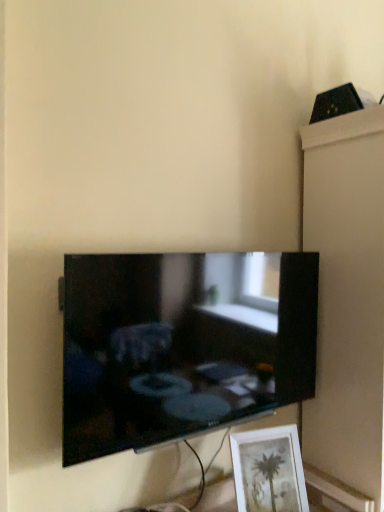
Question: Is black glossy tv at center next to matte white picture frame at lower right and touching it?

Choices:
 (A) yes
 (B) no

Answer: (B)

Question: Does black glossy tv at center have a lesser height compared to matte white picture frame at lower right?

Choices:
 (A) no
 (B) yes

Answer: (A)

Question: Is black glossy tv at center wider than matte white picture frame at lower right?

Choices:
 (A) yes
 (B) no

Answer: (B)

Question: Can you confirm if black glossy tv at center is positioned to the right of matte white picture frame at lower right?

Choices:
 (A) yes
 (B) no

Answer: (B)

Question: Does black glossy tv at center contain matte white picture frame at lower right?

Choices:
 (A) no
 (B) yes

Answer: (A)

Question: Can you confirm if black glossy tv at center is taller than matte white picture frame at lower right?

Choices:
 (A) no
 (B) yes

Answer: (B)

Question: Are black glossy tv at center and white glossy cabinet at upper right located far from each other?

Choices:
 (A) no
 (B) yes

Answer: (A)

Question: Is black glossy tv at center directly adjacent to white glossy cabinet at upper right?

Choices:
 (A) yes
 (B) no

Answer: (B)

Question: Can you confirm if black glossy tv at center is positioned to the right of white glossy cabinet at upper right?

Choices:
 (A) yes
 (B) no

Answer: (B)

Question: From a real-world perspective, is black glossy tv at center on top of white glossy cabinet at upper right?

Choices:
 (A) no
 (B) yes

Answer: (B)

Question: Considering the relative positions of black glossy tv at center and white glossy cabinet at upper right in the image provided, is black glossy tv at center to the left of white glossy cabinet at upper right from the viewer's perspective?

Choices:
 (A) yes
 (B) no

Answer: (A)

Question: Can white glossy cabinet at upper right be found inside black glossy tv at center?

Choices:
 (A) no
 (B) yes

Answer: (A)

Question: Does matte white picture frame at lower right touch white glossy cabinet at upper right?

Choices:
 (A) yes
 (B) no

Answer: (B)